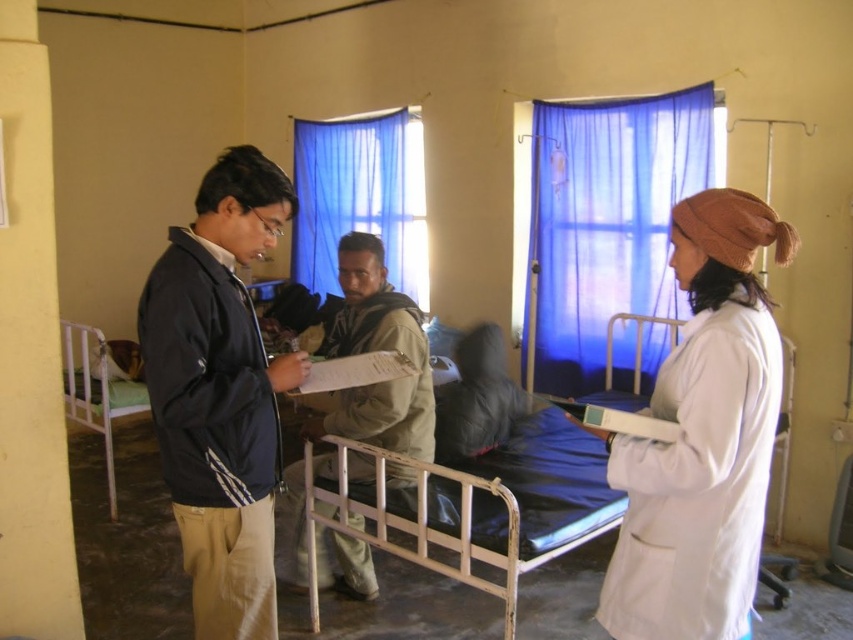
You are a nurse who needs to move a medical cart that is 1.5 meters wide through the space between the blue sheer curtain at upper center and the metallic hospital bed at left. Based on the scene description, can the cart fit through this space?

The blue sheer curtain at upper center has a width less than the metallic hospital bed at left. Since the curtain is narrower than the bed, the space between them might be insufficient for the 1.5 meter wide cart to pass through. However, without exact measurements of the gap, it is uncertain. The nurse should check the actual space before attempting to move the cart.

You are standing in the hospital ward and need to reach the point at coordinates (611, 634). The hospital has a rule that you must stay at least 1.5 meters away from all patients. Can you safely approach the point without violating the rule?

The distance between you and the point at coordinates (611, 634) is 1.79 meters, which is greater than the required 1.5 meters. Therefore, you can safely approach the point without violating the hospital rule.